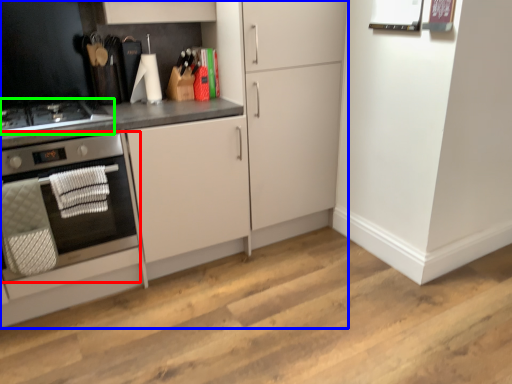
Question: Which object is the farthest from home appliance (highlighted by a red box)? Choose among these: cabinetry (highlighted by a blue box) or gas stove (highlighted by a green box).

Choices:
 (A) cabinetry
 (B) gas stove

Answer: (A)